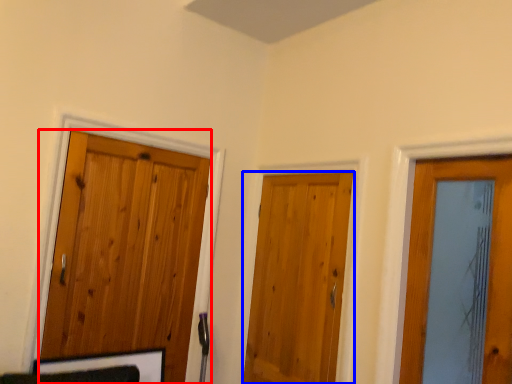
Question: Which of the following is the closest to the observer, door (highlighted by a red box) or door (highlighted by a blue box)?

Choices:
 (A) door
 (B) door

Answer: (A)